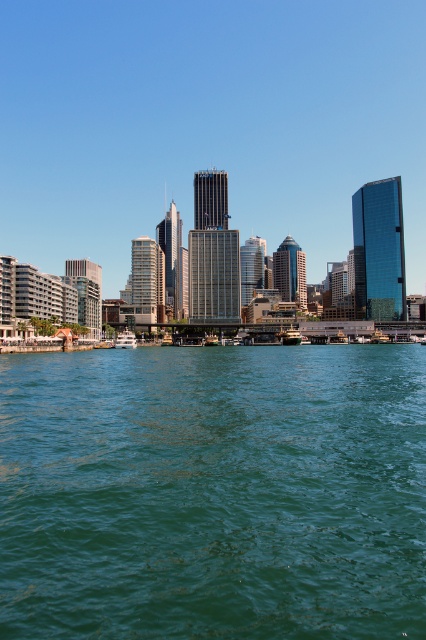
Question: Is green water at lower center closer to camera compared to white glossy boat at center?

Choices:
 (A) yes
 (B) no

Answer: (A)

Question: Which object appears farthest from the camera in this image?

Choices:
 (A) green water at lower center
 (B) white glossy boat at center

Answer: (B)

Question: Is green water at lower center positioned in front of white glossy boat at center?

Choices:
 (A) no
 (B) yes

Answer: (B)

Question: Can you confirm if green water at lower center is positioned to the left of white glossy boat at center?

Choices:
 (A) no
 (B) yes

Answer: (A)